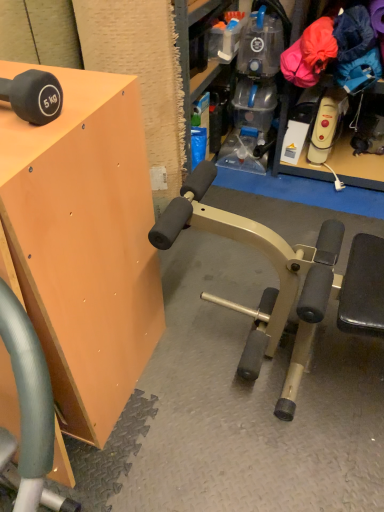
The image size is (384, 512). What do you see at coordinates (85, 244) in the screenshot?
I see `matte orange cabinet at upper left` at bounding box center [85, 244].

You are a GUI agent. You are given a task and a screenshot of the screen. Output one action in this format:
    pyautogui.click(x=<x>, y=<y>)
    Task: Click on the matte orange cabinet at upper left
    The width and height of the screenshot is (384, 512).
    Given the screenshot: What is the action you would take?
    pyautogui.click(x=85, y=244)

What is the approximate width of matte orange cabinet at upper left?

52.52 centimeters.

The image size is (384, 512). Describe the element at coordinates (33, 96) in the screenshot. I see `matte black dumbbell at upper left` at that location.

Find the location of a particular element. The image size is (384, 512). matte black dumbbell at upper left is located at coordinates (33, 96).

The image size is (384, 512). In order to click on matte orange cabinet at upper left in this screenshot , I will do (85, 244).

Considering the relative positions of matte black dumbbell at upper left and matte orange cabinet at upper left in the image provided, is matte black dumbbell at upper left to the left of matte orange cabinet at upper left from the viewer's perspective?

In fact, matte black dumbbell at upper left is to the right of matte orange cabinet at upper left.

Which is in front, matte black dumbbell at upper left or matte orange cabinet at upper left?

matte orange cabinet at upper left.

Which is in front, point (28, 105) or point (73, 250)?

Positioned in front is point (28, 105).

From the image's perspective, is matte black dumbbell at upper left beneath matte orange cabinet at upper left?

Incorrect, from the image's perspective, matte black dumbbell at upper left is higher than matte orange cabinet at upper left.

From a real-world perspective, who is located higher, matte black dumbbell at upper left or matte orange cabinet at upper left?

In real-world perspective, matte black dumbbell at upper left is above.

In the scene shown: Considering the sizes of objects matte black dumbbell at upper left and matte orange cabinet at upper left in the image provided, who is wider, matte black dumbbell at upper left or matte orange cabinet at upper left?

matte orange cabinet at upper left is wider.

Considering the sizes of objects matte black dumbbell at upper left and matte orange cabinet at upper left in the image provided, who is taller, matte black dumbbell at upper left or matte orange cabinet at upper left?

matte orange cabinet at upper left is taller.

Looking at the image, does matte black dumbbell at upper left seem bigger or smaller compared to matte orange cabinet at upper left?

Considering their sizes, matte black dumbbell at upper left takes up less space than matte orange cabinet at upper left.

Is matte orange cabinet at upper left inside matte black dumbbell at upper left?

Actually, matte orange cabinet at upper left is outside matte black dumbbell at upper left.

Is matte black dumbbell at upper left positioned far away from matte orange cabinet at upper left?

No, matte black dumbbell at upper left is not far away from matte orange cabinet at upper left.

Is matte black dumbbell at upper left facing towards matte orange cabinet at upper left?

No, matte black dumbbell at upper left is not facing towards matte orange cabinet at upper left.

This screenshot has width=384, height=512. In order to click on dumbbell above the matte orange cabinet at upper left (from a real-world perspective) in this screenshot , I will do `click(33, 96)`.

Does matte orange cabinet at upper left appear on the left side of matte black dumbbell at upper left?

Indeed, matte orange cabinet at upper left is positioned on the left side of matte black dumbbell at upper left.

Considering the relative positions of matte orange cabinet at upper left and matte black dumbbell at upper left in the image provided, is matte orange cabinet at upper left behind matte black dumbbell at upper left?

No, the depth of matte orange cabinet at upper left is less than that of matte black dumbbell at upper left.

Does point (97, 126) appear closer or farther from the camera than point (33, 100)?

Point (97, 126) is farther from the camera than point (33, 100).

From the image's perspective, would you say matte orange cabinet at upper left is positioned over matte black dumbbell at upper left?

No, from the image's perspective, matte orange cabinet at upper left is not on top of matte black dumbbell at upper left.

From a real-world perspective, which is physically above, matte orange cabinet at upper left or matte black dumbbell at upper left?

From a 3D spatial view, matte black dumbbell at upper left is above.

Between matte orange cabinet at upper left and matte black dumbbell at upper left, which one has larger width?

matte orange cabinet at upper left.

Considering the relative sizes of matte orange cabinet at upper left and matte black dumbbell at upper left in the image provided, is matte orange cabinet at upper left taller than matte black dumbbell at upper left?

Correct, matte orange cabinet at upper left is much taller as matte black dumbbell at upper left.

Looking at the image, does matte orange cabinet at upper left seem bigger or smaller compared to matte black dumbbell at upper left?

Considering their sizes, matte orange cabinet at upper left takes up more space than matte black dumbbell at upper left.

Is matte orange cabinet at upper left spatially inside matte black dumbbell at upper left, or outside of it?

matte orange cabinet at upper left exists outside the volume of matte black dumbbell at upper left.

Is matte orange cabinet at upper left far away from matte black dumbbell at upper left?

matte orange cabinet at upper left is actually quite close to matte black dumbbell at upper left.

Is matte black dumbbell at upper left at the back of matte orange cabinet at upper left?

matte orange cabinet at upper left does not have its back to matte black dumbbell at upper left.

Locate an element on the screen. dumbbell above the matte orange cabinet at upper left (from the image's perspective) is located at coordinates (33, 96).

At what (x,y) coordinates should I click in order to perform the action: click on dumbbell above the matte orange cabinet at upper left (from the image's perspective). Please return your answer as a coordinate pair (x, y). Image resolution: width=384 pixels, height=512 pixels. Looking at the image, I should click on (33, 96).

Locate an element on the screen. The height and width of the screenshot is (512, 384). table in front of the matte black dumbbell at upper left is located at coordinates (85, 244).